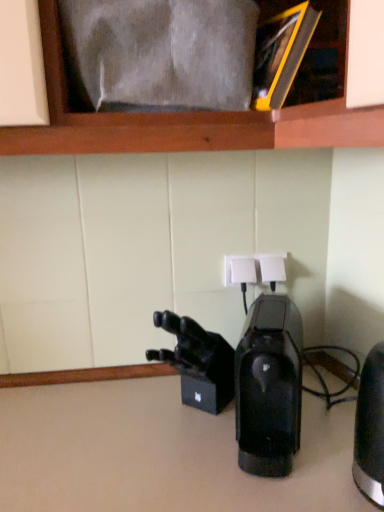
Question: From the image's perspective, is black metallic kettle at right, which is counted as the 1th home appliance, starting from the right, on white plastic electrical outlet at center?

Choices:
 (A) yes
 (B) no

Answer: (B)

Question: Can you confirm if black metallic kettle at right, which is counted as the 1th home appliance, starting from the right, is thinner than white plastic electrical outlet at center?

Choices:
 (A) yes
 (B) no

Answer: (B)

Question: Is black metallic kettle at right, which is counted as the 1th home appliance, starting from the right, smaller than white plastic electrical outlet at center?

Choices:
 (A) yes
 (B) no

Answer: (B)

Question: Does black metallic kettle at right, which is counted as the 1th home appliance, starting from the right, have a greater width compared to white plastic electrical outlet at center?

Choices:
 (A) no
 (B) yes

Answer: (B)

Question: Does black metallic kettle at right, which is counted as the 2th home appliance, starting from the left, come behind white plastic electrical outlet at center?

Choices:
 (A) yes
 (B) no

Answer: (B)

Question: Is white plastic electrical outlet at center inside black metallic kettle at right, which is counted as the 1th home appliance, starting from the right?

Choices:
 (A) yes
 (B) no

Answer: (B)

Question: Is white plastic electrical outlet at center aimed at black matte/video camera at center?

Choices:
 (A) no
 (B) yes

Answer: (A)

Question: Is white plastic electrical outlet at center further to camera compared to black matte/video camera at center?

Choices:
 (A) no
 (B) yes

Answer: (B)

Question: Considering the relative positions of white plastic electrical outlet at center and black matte/video camera at center in the image provided, is white plastic electrical outlet at center to the left of black matte/video camera at center from the viewer's perspective?

Choices:
 (A) no
 (B) yes

Answer: (A)

Question: Are white plastic electrical outlet at center and black matte/video camera at center making contact?

Choices:
 (A) no
 (B) yes

Answer: (A)

Question: Is black matte/video camera at center at the back of white plastic electrical outlet at center?

Choices:
 (A) yes
 (B) no

Answer: (B)

Question: Does white plastic electrical outlet at center have a larger size compared to black matte/video camera at center?

Choices:
 (A) no
 (B) yes

Answer: (A)

Question: Does black matte/video camera at center contain black metallic kettle at right, which is counted as the 1th home appliance, starting from the right?

Choices:
 (A) yes
 (B) no

Answer: (B)